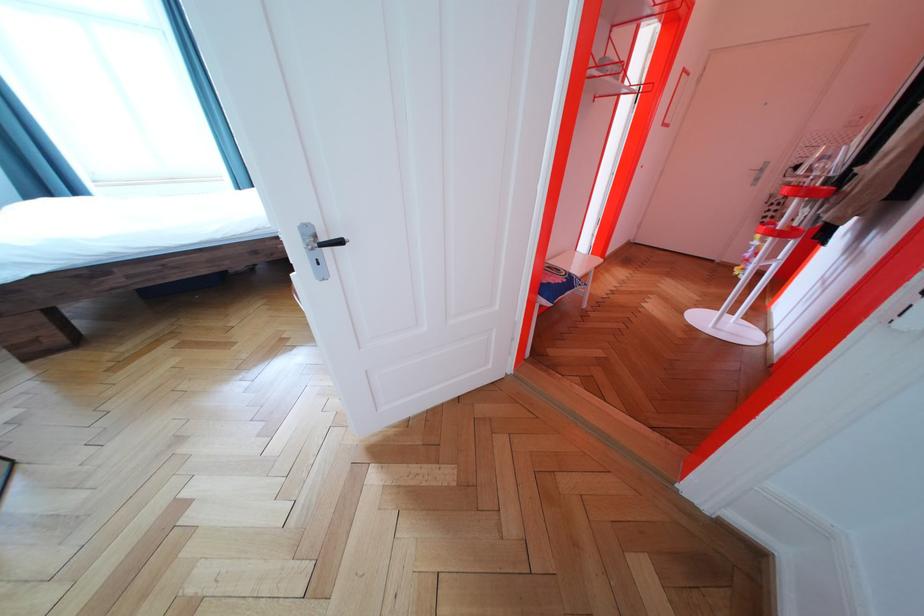
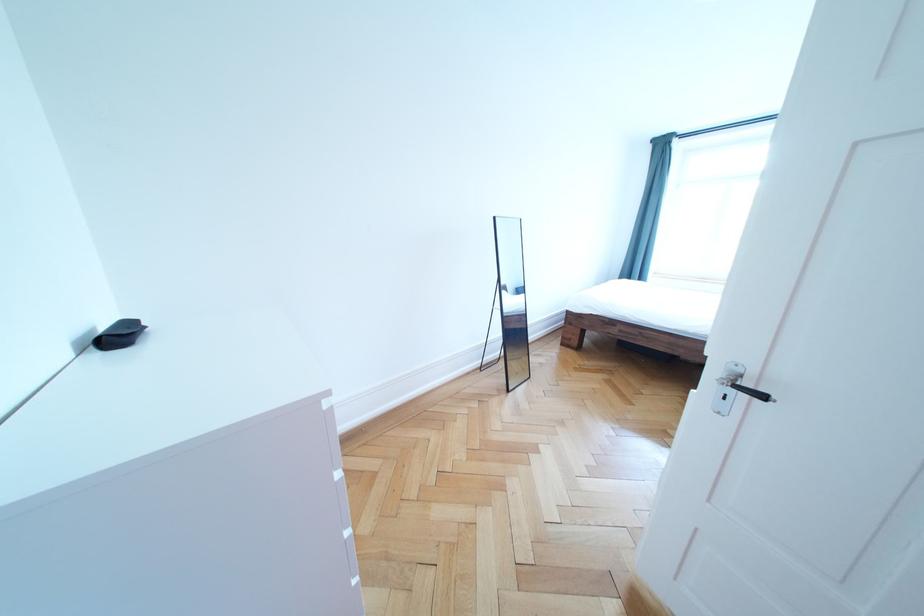
In the second image, find the point that corresponds to the point at 334,245 in the first image.

(757, 389)